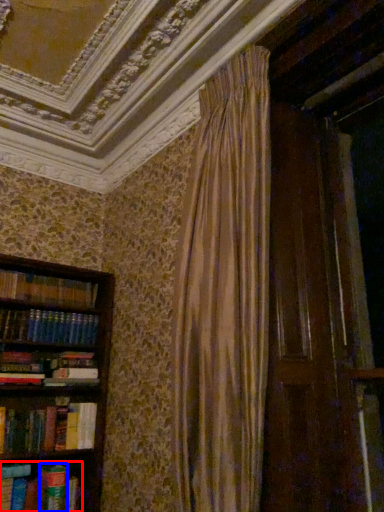
Question: Which object appears closest to the camera in this image, book (highlighted by a red box) or paperback book (highlighted by a blue box)?

Choices:
 (A) book
 (B) paperback book

Answer: (A)